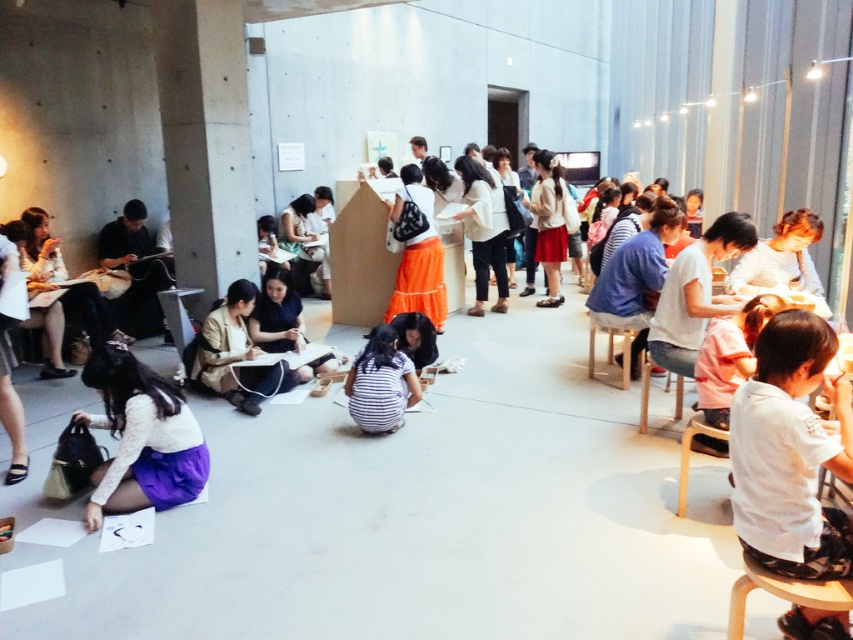
You are standing at the entrance of the workshop and notice a striped fabric at center. If you want to reach it, in which direction should you move relative to your current position?

The striped fabric at center is located at point 0.600 on the x axis and 0.447 on the y axis. Since you are at the entrance, which is typically at the lower left corner of the space, moving towards the center would involve going northeast to reach the striped fabric at center.

You are standing in the workshop and want to move from point A to point B. Point A is at coordinate point (207, 337) and point B is at coordinate point (683, 512). Considering the spatial relationship between these two points, which direction should you move to go from point A to point B?

To move from point A at (207, 337) to point B at (683, 512), you should move diagonally towards the upper right direction since point B is both higher and further to the right compared to point A.

You are an observer in the workshop. You see the matte beige jacket at center and the light wood chair at lower right. Which object is positioned higher in the image?

The matte beige jacket at center is above the light wood chair at lower right, so it is positioned higher in the image.